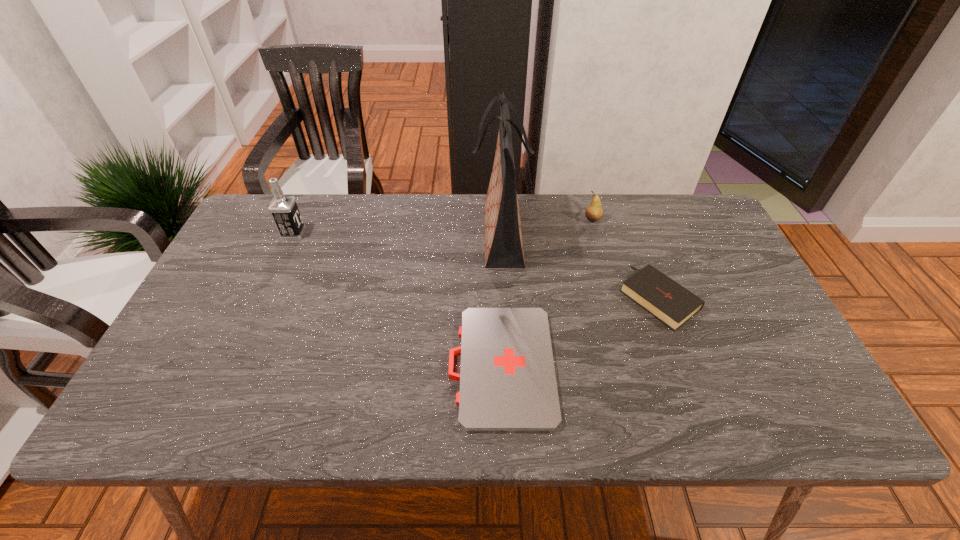
Locate an element on the screen. This screenshot has height=540, width=960. object that is positioned at the far left corner is located at coordinates (284, 210).

Where is `vacant space at the far edge of the desktop`? vacant space at the far edge of the desktop is located at coordinates (402, 224).

In the image, there is a desktop. At what (x,y) coordinates should I click in order to perform the action: click on vacant space at the near edge. Please return your answer as a coordinate pair (x, y). This screenshot has width=960, height=540. Looking at the image, I should click on point(444,401).

The image size is (960, 540). In order to click on vacant space at the left edge in this screenshot , I will do `click(222, 276)`.

Locate an element on the screen. Image resolution: width=960 pixels, height=540 pixels. free space at the right edge is located at coordinates (730, 369).

In the image, there is a desktop. Identify the location of free space at the far right corner. (710, 220).

The width and height of the screenshot is (960, 540). Find the location of `unoccupied area between the vodka and the Bible`. unoccupied area between the vodka and the Bible is located at coordinates (476, 266).

Identify the location of vacant area that lies between the tallest object and the shortest object. This screenshot has width=960, height=540. (501, 300).

What are the coordinates of `vacant point located between the leftmost object and the Bible` in the screenshot? It's located at (476, 266).

You are a GUI agent. You are given a task and a screenshot of the screen. Output one action in this format:
    pyautogui.click(x=<x>, y=<y>)
    Task: Click on the free space that is in between the pear and the Bible
    The height and width of the screenshot is (540, 960).
    Given the screenshot: What is the action you would take?
    pyautogui.click(x=626, y=258)